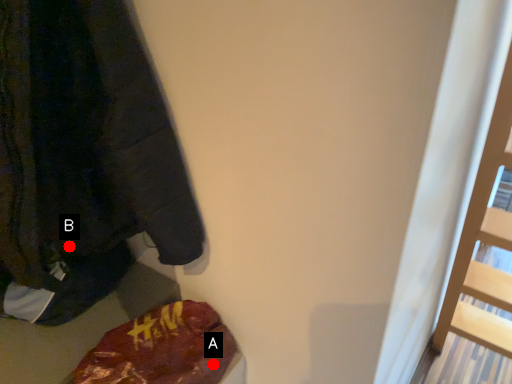
Question: Two points are circled on the image, labeled by A and B beside each circle. Which point is further to the camera?

Choices:
 (A) A is further
 (B) B is further

Answer: (A)